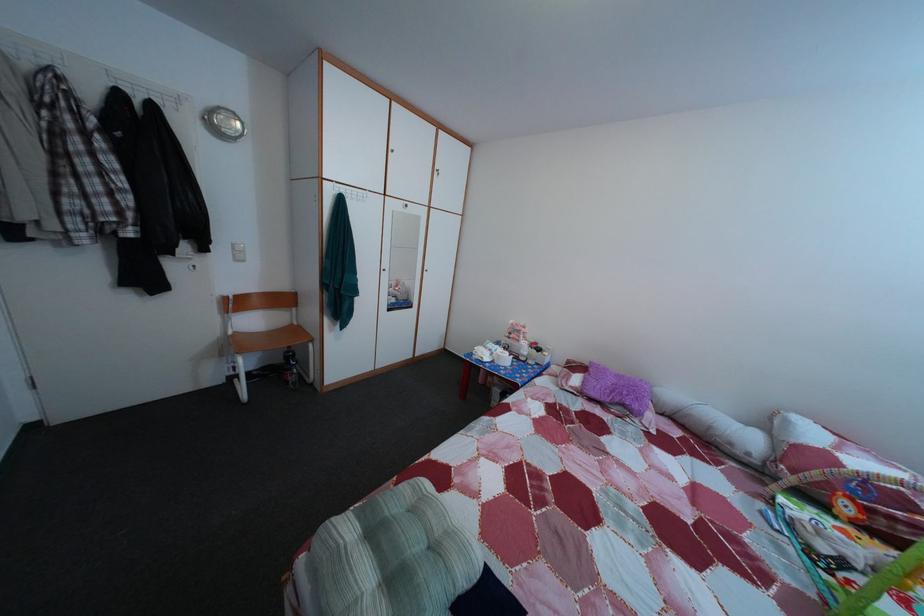
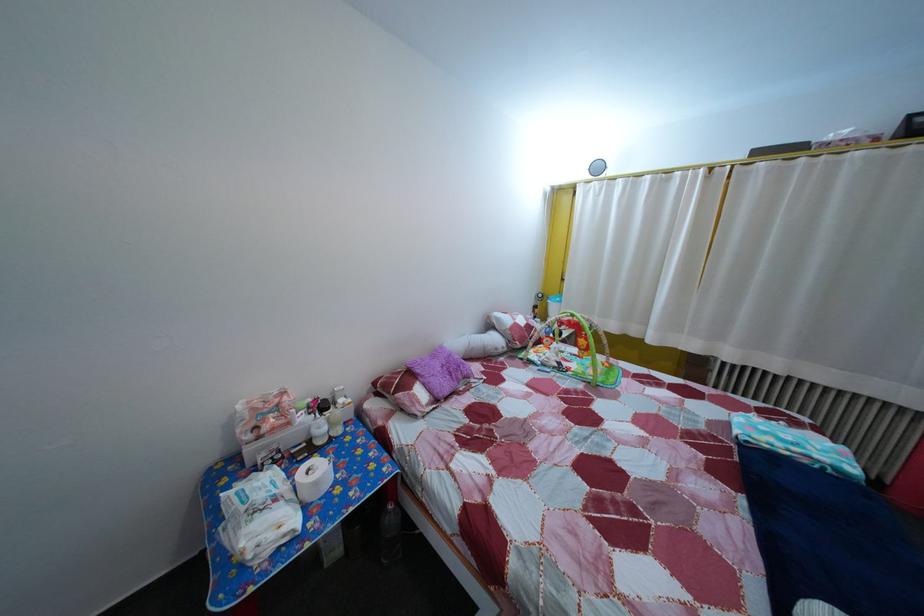
In the second image, find the point that corresponds to (x=759, y=448) in the first image.

(505, 347)